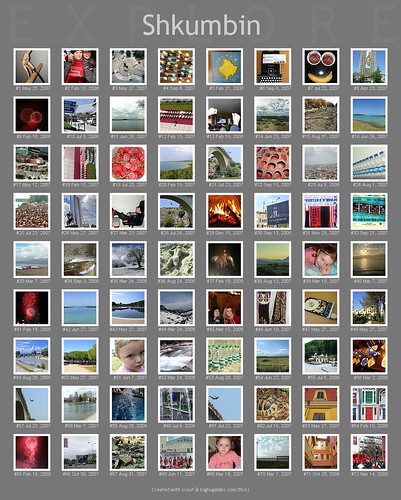
Image resolution: width=401 pixels, height=500 pixels. I want to click on pictures in top row, so pos(375,72), pos(325,67), pos(270,66), pos(232,65), pos(177,62), pos(124,64), pos(87,62), pos(38,72).